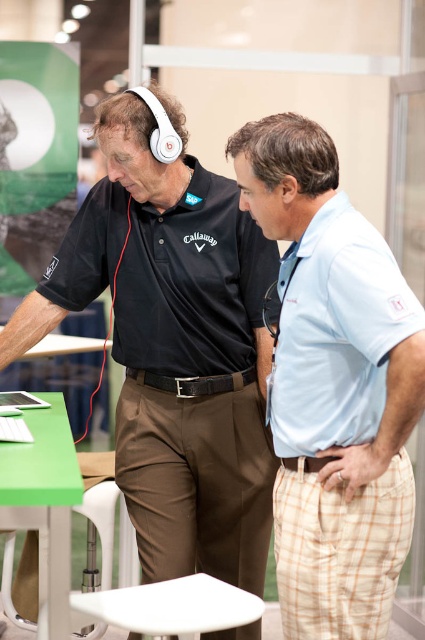
Is point (23, 470) farther from viewer compared to point (76, 605)?

No, (23, 470) is closer to viewer.

Who is shorter, green matte table at lower left or white plastic stool at lower center?

white plastic stool at lower center

Is point (74, 486) more distant than point (220, 588)?

That is False.

At what (x,y) coordinates should I click in order to perform the action: click on green matte table at lower left. Please return your answer as a coordinate pair (x, y). The image size is (425, 640). Looking at the image, I should click on (47, 493).

Is black matte headphones at upper left wider than light blue cotton polo shirt at right?

Correct, the width of black matte headphones at upper left exceeds that of light blue cotton polo shirt at right.

Describe the element at coordinates (173, 346) in the screenshot. I see `black matte headphones at upper left` at that location.

Does point (180, 212) come in front of point (331, 294)?

No, it is not.

Find the location of a particular element. The image size is (425, 640). black matte headphones at upper left is located at coordinates (173, 346).

Can you confirm if black matte headphones at upper left is thinner than white plastic stool at lower center?

No, black matte headphones at upper left is not thinner than white plastic stool at lower center.

Is point (187, 419) farther from viewer compared to point (200, 595)?

Yes, point (187, 419) is behind point (200, 595).

Image resolution: width=425 pixels, height=640 pixels. Find the location of `black matte headphones at upper left`. black matte headphones at upper left is located at coordinates (x=173, y=346).